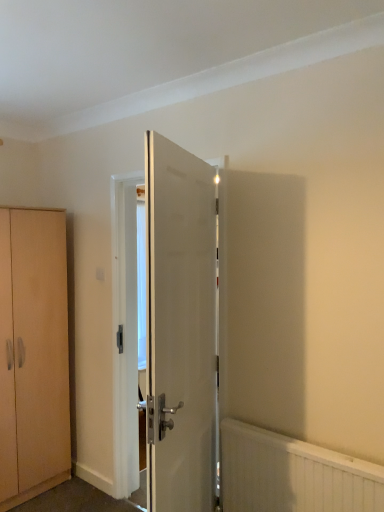
Question: From a real-world perspective, is white glossy door at center physically above light brown wood cabinet at left?

Choices:
 (A) yes
 (B) no

Answer: (A)

Question: Considering the relative positions of white glossy door at center and light brown wood cabinet at left in the image provided, is white glossy door at center in front of light brown wood cabinet at left?

Choices:
 (A) no
 (B) yes

Answer: (B)

Question: Does white glossy door at center have a smaller size compared to light brown wood cabinet at left?

Choices:
 (A) yes
 (B) no

Answer: (A)

Question: Is white glossy door at center positioned far away from light brown wood cabinet at left?

Choices:
 (A) yes
 (B) no

Answer: (A)

Question: Is light brown wood cabinet at left completely or partially inside white glossy door at center?

Choices:
 (A) no
 (B) yes

Answer: (A)

Question: Is light brown wood cabinet at left inside the boundaries of white textured radiator at lower right, or outside?

Choices:
 (A) outside
 (B) inside

Answer: (A)

Question: Considering the positions of light brown wood cabinet at left and white textured radiator at lower right in the image, is light brown wood cabinet at left wider or thinner than white textured radiator at lower right?

Choices:
 (A) thin
 (B) wide

Answer: (B)

Question: In the image, is light brown wood cabinet at left positioned in front of or behind white textured radiator at lower right?

Choices:
 (A) front
 (B) behind

Answer: (B)

Question: Is light brown wood cabinet at left to the left or to the right of white textured radiator at lower right in the image?

Choices:
 (A) right
 (B) left

Answer: (B)

Question: Considering the positions of white glossy door at center and light brown wood cabinet at left in the image, is white glossy door at center bigger or smaller than light brown wood cabinet at left?

Choices:
 (A) small
 (B) big

Answer: (A)

Question: Considering the positions of white glossy door at center and light brown wood cabinet at left in the image, is white glossy door at center wider or thinner than light brown wood cabinet at left?

Choices:
 (A) thin
 (B) wide

Answer: (A)

Question: From the image's perspective, is white glossy door at center positioned above or below light brown wood cabinet at left?

Choices:
 (A) below
 (B) above

Answer: (B)

Question: Is white glossy door at center inside the boundaries of light brown wood cabinet at left, or outside?

Choices:
 (A) outside
 (B) inside

Answer: (A)

Question: Is light brown wood cabinet at left bigger or smaller than white glossy door at center?

Choices:
 (A) big
 (B) small

Answer: (A)

Question: Considering the positions of light brown wood cabinet at left and white glossy door at center in the image, is light brown wood cabinet at left wider or thinner than white glossy door at center?

Choices:
 (A) wide
 (B) thin

Answer: (A)